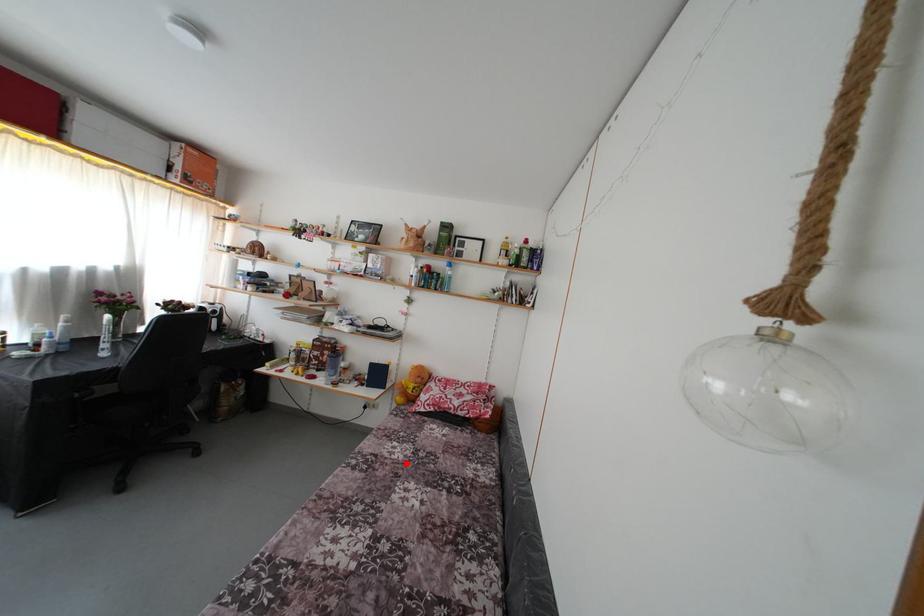
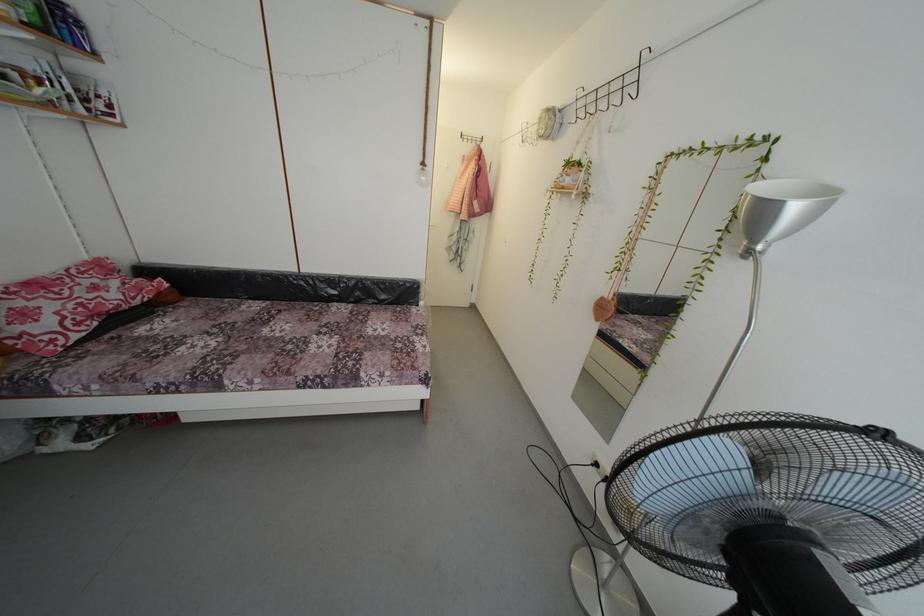
Find the pixel in the second image that matches the highlighted location in the first image.

(225, 345)